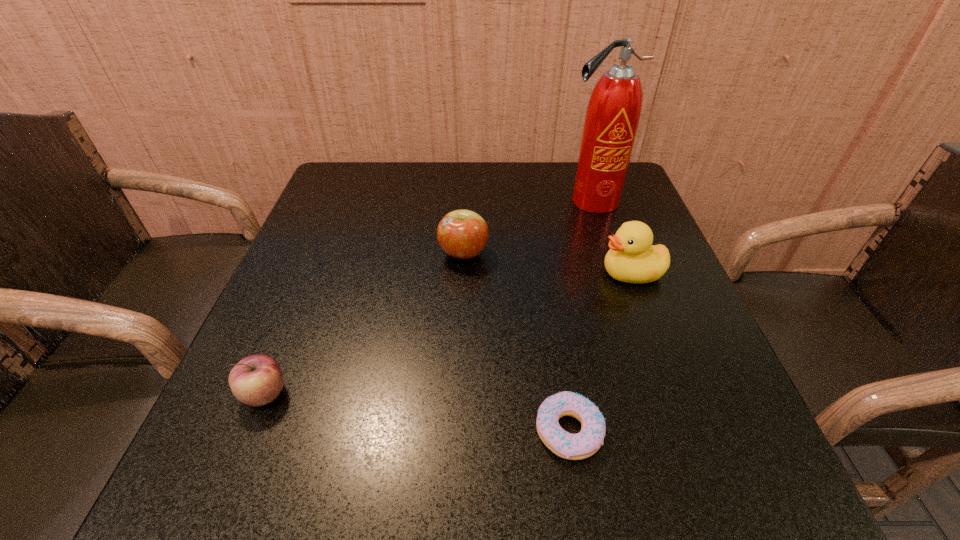
Identify the location of blank area in the image that satisfies the following two spatial constraints: 1. on the front side of the doughnut; 2. on the left side of the left apple. (251, 431).

Find the location of a particular element. Image resolution: width=960 pixels, height=540 pixels. free location that satisfies the following two spatial constraints: 1. on the back side of the tallest object; 2. on the right side of the left apple is located at coordinates (344, 201).

Find the location of a particular element. This screenshot has width=960, height=540. vacant space that satisfies the following two spatial constraints: 1. on the front side of the doughnut; 2. on the right side of the nearer apple is located at coordinates (251, 431).